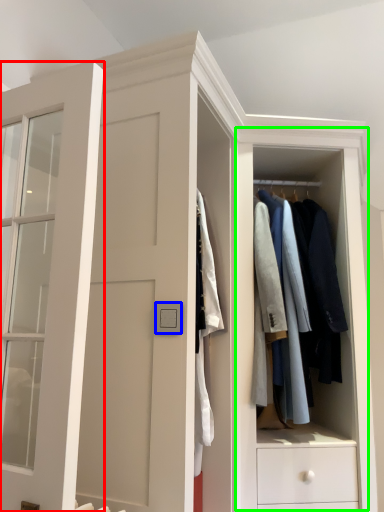
Question: Estimate the real-world distances between objects in this image. Which object is farther from door (highlighted by a red box), light switch (highlighted by a blue box) or dresser (highlighted by a green box)?

Choices:
 (A) light switch
 (B) dresser

Answer: (B)